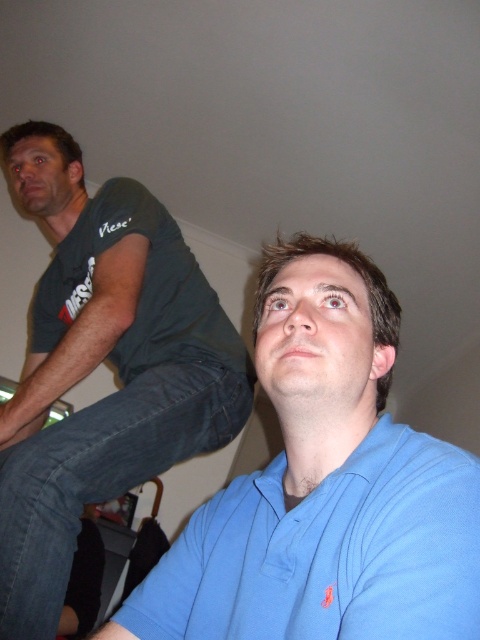
Is the position of blue cotton shirt at lower right less distant than that of dark green t-shirt at left?

Yes, blue cotton shirt at lower right is closer to the viewer.

Between blue cotton shirt at lower right and dark green t-shirt at left, which one has less height?

blue cotton shirt at lower right is shorter.

Find the location of `blue cotton shirt at lower right`. blue cotton shirt at lower right is located at coordinates (324, 484).